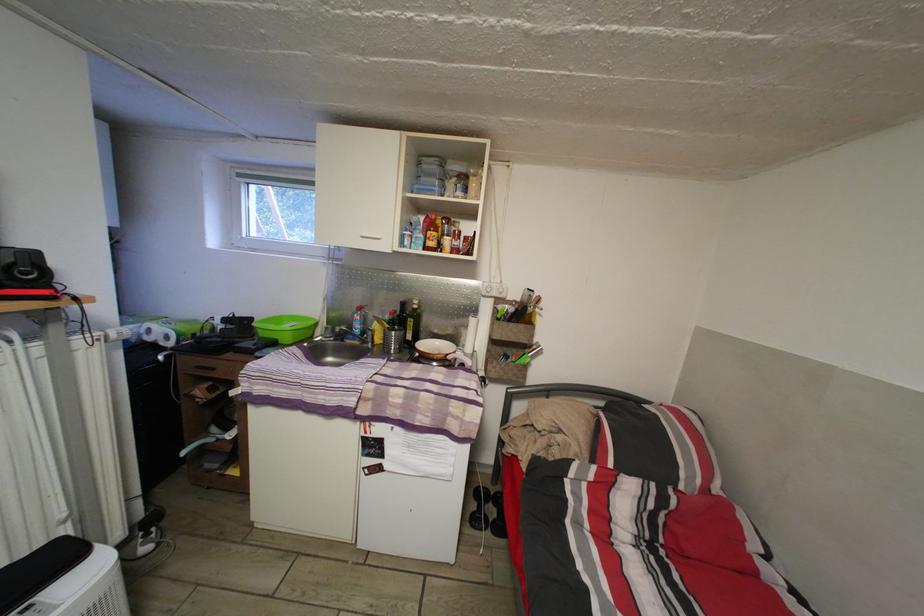
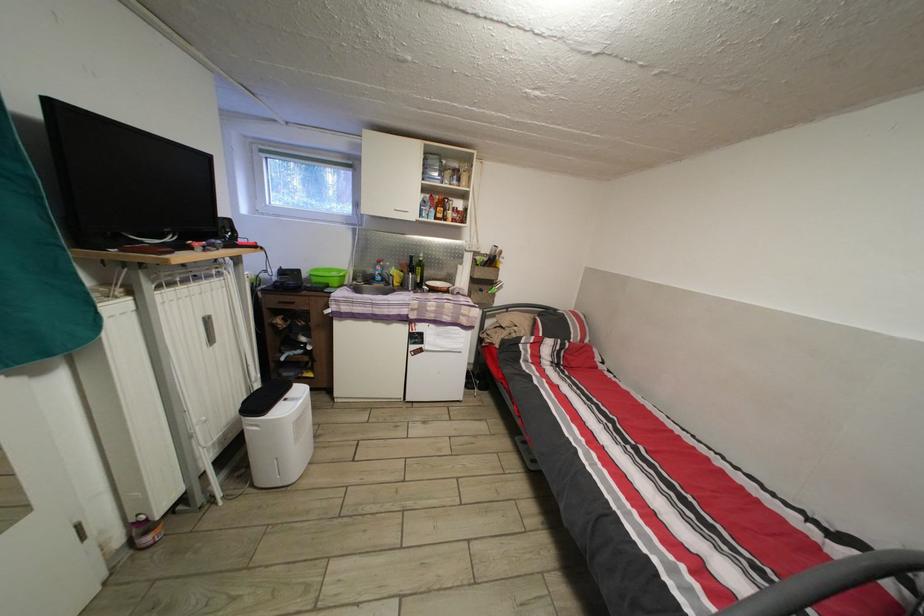
Where in the second image is the point corresponding to pixel 409 310 from the first image?

(419, 265)